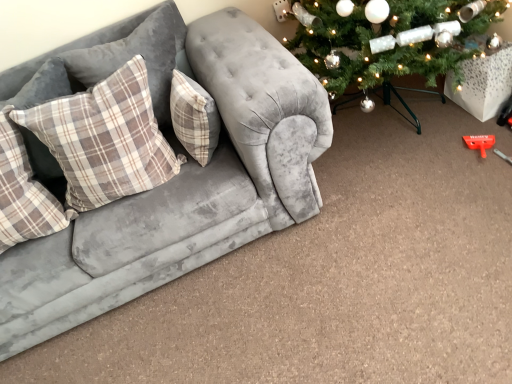
The width and height of the screenshot is (512, 384). Find the location of `plaid fabric pillow at left, the second pillow positioned from the right`. plaid fabric pillow at left, the second pillow positioned from the right is located at coordinates (140, 54).

What do you see at coordinates (140, 54) in the screenshot? The image size is (512, 384). I see `plaid fabric pillow at left, which appears as the 3th pillow when viewed from the left` at bounding box center [140, 54].

In order to face plaid fabric pillow at left, positioned as the second pillow in left-to-right order, should I rotate leftwards or rightwards?

Rotate left and turn 19.319 degrees.

The height and width of the screenshot is (384, 512). Identify the location of plaid fabric pillow at left, positioned as the second pillow in left-to-right order. (105, 139).

In order to face plaid fabric pillow at center, placed as the 4th pillow when sorted from left to right, should I rotate leftwards or rightwards?

To face it directly, rotate left by 8.283 degrees.

What do you see at coordinates (180, 189) in the screenshot? I see `velvet grey couch at left` at bounding box center [180, 189].

The width and height of the screenshot is (512, 384). What are the coordinates of `plaid fabric pillow at left, the second pillow positioned from the right` in the screenshot? It's located at (140, 54).

Is plaid fabric pillow at left, which appears as the 3th pillow when viewed from the left, at the back of plaid fabric pillow at left, positioned as the second pillow in left-to-right order?

That's right, plaid fabric pillow at left, positioned as the second pillow in left-to-right order, is facing away from plaid fabric pillow at left, which appears as the 3th pillow when viewed from the left.

Is plaid fabric pillow at left, positioned as the second pillow in left-to-right order, positioned far away from plaid fabric pillow at left, which appears as the 3th pillow when viewed from the left?

No.

Considering the sizes of objects plaid fabric pillow at left, positioned as the second pillow in left-to-right order, and plaid fabric pillow at left, the second pillow positioned from the right, in the image provided, who is wider, plaid fabric pillow at left, positioned as the second pillow in left-to-right order, or plaid fabric pillow at left, the second pillow positioned from the right,?

Wider between the two is plaid fabric pillow at left, positioned as the second pillow in left-to-right order.

Between plaid fabric pillow at left, positioned as the second pillow in left-to-right order, and plaid fabric pillow at left, which appears as the 3th pillow when viewed from the left, which one has larger size?

plaid fabric pillow at left, positioned as the second pillow in left-to-right order.

Looking at their sizes, would you say velvet grey couch at left is wider or thinner than plaid fabric pillow at left, which appears as the 4th pillow when viewed from the right?

Clearly, velvet grey couch at left has more width compared to plaid fabric pillow at left, which appears as the 4th pillow when viewed from the right.

From a real-world perspective, does velvet grey couch at left stand above plaid fabric pillow at left, which appears as the 4th pillow when viewed from the right?

No, from a real-world perspective, velvet grey couch at left is not over plaid fabric pillow at left, which appears as the 4th pillow when viewed from the right

Is velvet grey couch at left not close to plaid fabric pillow at left, acting as the 1th pillow starting from the left?

Actually, velvet grey couch at left and plaid fabric pillow at left, acting as the 1th pillow starting from the left, are a little close together.

Does plaid fabric pillow at left, the 3th pillow in the right-to-left sequence, contain velvet grey couch at left?

No, plaid fabric pillow at left, the 3th pillow in the right-to-left sequence, does not contain velvet grey couch at left.

Considering the positions of objects plaid fabric pillow at left, positioned as the second pillow in left-to-right order, and velvet grey couch at left in the image provided, who is behind, plaid fabric pillow at left, positioned as the second pillow in left-to-right order, or velvet grey couch at left?

plaid fabric pillow at left, positioned as the second pillow in left-to-right order, is further away from the camera.

Is plaid fabric pillow at left, the 3th pillow in the right-to-left sequence, with velvet grey couch at left?

No, plaid fabric pillow at left, the 3th pillow in the right-to-left sequence, is not beside velvet grey couch at left.

Is plaid fabric pillow at left, positioned as the second pillow in left-to-right order, bigger than velvet grey couch at left?

No.

How distant is plaid fabric pillow at left, the 3th pillow in the right-to-left sequence, from plaid fabric pillow at left, which appears as the 4th pillow when viewed from the right?

plaid fabric pillow at left, the 3th pillow in the right-to-left sequence, is 9.31 inches from plaid fabric pillow at left, which appears as the 4th pillow when viewed from the right.

Which of these two, plaid fabric pillow at left, the 3th pillow in the right-to-left sequence, or plaid fabric pillow at left, which appears as the 4th pillow when viewed from the right, stands taller?

With more height is plaid fabric pillow at left, which appears as the 4th pillow when viewed from the right.

Is plaid fabric pillow at left, the 3th pillow in the right-to-left sequence, thinner than plaid fabric pillow at left, acting as the 1th pillow starting from the left?

No.

Is plaid fabric pillow at left, positioned as the second pillow in left-to-right order, positioned far away from plaid fabric pillow at left, which appears as the 4th pillow when viewed from the right?

They are positioned close to each other.

Does plaid fabric pillow at left, which appears as the 3th pillow when viewed from the left, have a lesser width compared to plaid fabric pillow at left, which appears as the 4th pillow when viewed from the right?

Correct, the width of plaid fabric pillow at left, which appears as the 3th pillow when viewed from the left, is less than that of plaid fabric pillow at left, which appears as the 4th pillow when viewed from the right.

Would you say plaid fabric pillow at left, which appears as the 3th pillow when viewed from the left, contains plaid fabric pillow at left, acting as the 1th pillow starting from the left?

Actually, plaid fabric pillow at left, acting as the 1th pillow starting from the left, is outside plaid fabric pillow at left, which appears as the 3th pillow when viewed from the left.

Is plaid fabric pillow at left, which appears as the 3th pillow when viewed from the left, looking in the opposite direction of plaid fabric pillow at left, which appears as the 4th pillow when viewed from the right?

No, plaid fabric pillow at left, which appears as the 3th pillow when viewed from the left, is not facing away from plaid fabric pillow at left, which appears as the 4th pillow when viewed from the right.

Consider the image. In the image, is plaid fabric pillow at left, which appears as the 3th pillow when viewed from the left, on the left side or the right side of plaid fabric pillow at left, acting as the 1th pillow starting from the left?

Based on their positions, plaid fabric pillow at left, which appears as the 3th pillow when viewed from the left, is located to the right of plaid fabric pillow at left, acting as the 1th pillow starting from the left.

From the image's perspective, between velvet grey couch at left and plaid fabric pillow at center, placed as the 4th pillow when sorted from left to right, who is located below?

From the image's view, velvet grey couch at left is below.

Identify the location of the 3rd pillow to the right of the velvet grey couch at left, counting from the anchor's position. (194, 117).

Who is smaller, velvet grey couch at left or plaid fabric pillow at center, placed as the 4th pillow when sorted from left to right?

With smaller size is plaid fabric pillow at center, placed as the 4th pillow when sorted from left to right.

Between plaid fabric pillow at left, which appears as the 3th pillow when viewed from the left, and plaid fabric pillow at center, placed as the 4th pillow when sorted from left to right, which one appears on the left side from the viewer's perspective?

Positioned to the left is plaid fabric pillow at left, which appears as the 3th pillow when viewed from the left.

Is plaid fabric pillow at left, which appears as the 3th pillow when viewed from the left, positioned in front of plaid fabric pillow at center, placed as the 4th pillow when sorted from left to right?

No, plaid fabric pillow at left, which appears as the 3th pillow when viewed from the left, is further to the viewer.

From the image's perspective, between plaid fabric pillow at left, which appears as the 3th pillow when viewed from the left, and plaid fabric pillow at center, the first pillow in the right-to-left sequence, who is located below?

plaid fabric pillow at center, the first pillow in the right-to-left sequence, from the image's perspective.

In terms of size, does plaid fabric pillow at left, the second pillow positioned from the right, appear bigger or smaller than plaid fabric pillow at center, placed as the 4th pillow when sorted from left to right?

Clearly, plaid fabric pillow at left, the second pillow positioned from the right, is larger in size than plaid fabric pillow at center, placed as the 4th pillow when sorted from left to right.

Which pillow is the 2nd one when counting from the back of the plaid fabric pillow at left, the 3th pillow in the right-to-left sequence? Please provide its 2D coordinates.

[(140, 54)]

I want to click on studio couch above the plaid fabric pillow at left, which appears as the 4th pillow when viewed from the right (from the image's perspective), so click(180, 189).

Estimate the real-world distances between objects in this image. Which object is closer to velvet grey couch at left, plaid fabric pillow at left, which appears as the 4th pillow when viewed from the right, or plaid fabric pillow at left, which appears as the 3th pillow when viewed from the left?

Based on the image, plaid fabric pillow at left, which appears as the 3th pillow when viewed from the left, appears to be nearer to velvet grey couch at left.

Considering their positions, is plaid fabric pillow at center, placed as the 4th pillow when sorted from left to right, positioned further to plaid fabric pillow at left, which appears as the 4th pillow when viewed from the right, than plaid fabric pillow at left, which appears as the 3th pillow when viewed from the left?

Based on the image, plaid fabric pillow at center, placed as the 4th pillow when sorted from left to right, appears to be further to plaid fabric pillow at left, which appears as the 4th pillow when viewed from the right.

Looking at the image, which one is located closer to velvet grey couch at left, plaid fabric pillow at left, acting as the 1th pillow starting from the left, or plaid fabric pillow at left, the 3th pillow in the right-to-left sequence?

Among the two, plaid fabric pillow at left, the 3th pillow in the right-to-left sequence, is located nearer to velvet grey couch at left.

When comparing their distances from velvet grey couch at left, does plaid fabric pillow at left, the second pillow positioned from the right, or plaid fabric pillow at center, placed as the 4th pillow when sorted from left to right, seem closer?

plaid fabric pillow at center, placed as the 4th pillow when sorted from left to right, lies closer to velvet grey couch at left than the other object.

Which object lies nearer to the anchor point plaid fabric pillow at center, the first pillow in the right-to-left sequence, plaid fabric pillow at left, acting as the 1th pillow starting from the left, or plaid fabric pillow at left, positioned as the second pillow in left-to-right order?

plaid fabric pillow at left, positioned as the second pillow in left-to-right order, is positioned closer to the anchor plaid fabric pillow at center, the first pillow in the right-to-left sequence.

Looking at the image, which one is located further to plaid fabric pillow at left, which appears as the 4th pillow when viewed from the right, plaid fabric pillow at left, positioned as the second pillow in left-to-right order, or plaid fabric pillow at center, placed as the 4th pillow when sorted from left to right?

plaid fabric pillow at center, placed as the 4th pillow when sorted from left to right.

Which object lies nearer to the anchor point plaid fabric pillow at left, which appears as the 3th pillow when viewed from the left, plaid fabric pillow at center, the first pillow in the right-to-left sequence, or plaid fabric pillow at left, which appears as the 4th pillow when viewed from the right?

plaid fabric pillow at center, the first pillow in the right-to-left sequence.

Which object lies further to the anchor point velvet grey couch at left, plaid fabric pillow at left, the 3th pillow in the right-to-left sequence, or plaid fabric pillow at center, the first pillow in the right-to-left sequence?

The object further to velvet grey couch at left is plaid fabric pillow at center, the first pillow in the right-to-left sequence.

The height and width of the screenshot is (384, 512). What are the coordinates of `studio couch that lies between plaid fabric pillow at left, the second pillow positioned from the right, and plaid fabric pillow at left, acting as the 1th pillow starting from the left, from top to bottom` in the screenshot? It's located at (180, 189).

Locate an element on the screen. pillow situated between plaid fabric pillow at left, the 3th pillow in the right-to-left sequence, and plaid fabric pillow at center, the first pillow in the right-to-left sequence, from left to right is located at coordinates (140, 54).

You are a GUI agent. You are given a task and a screenshot of the screen. Output one action in this format:
    pyautogui.click(x=<x>, y=<y>)
    Task: Click on the studio couch between plaid fabric pillow at left, which appears as the 4th pillow when viewed from the right, and plaid fabric pillow at left, positioned as the second pillow in left-to-right order, from left to right
    
    Given the screenshot: What is the action you would take?
    pyautogui.click(x=180, y=189)

Locate an element on the screen. The width and height of the screenshot is (512, 384). studio couch located between plaid fabric pillow at left, acting as the 1th pillow starting from the left, and plaid fabric pillow at center, placed as the 4th pillow when sorted from left to right, in the left-right direction is located at coordinates (180, 189).